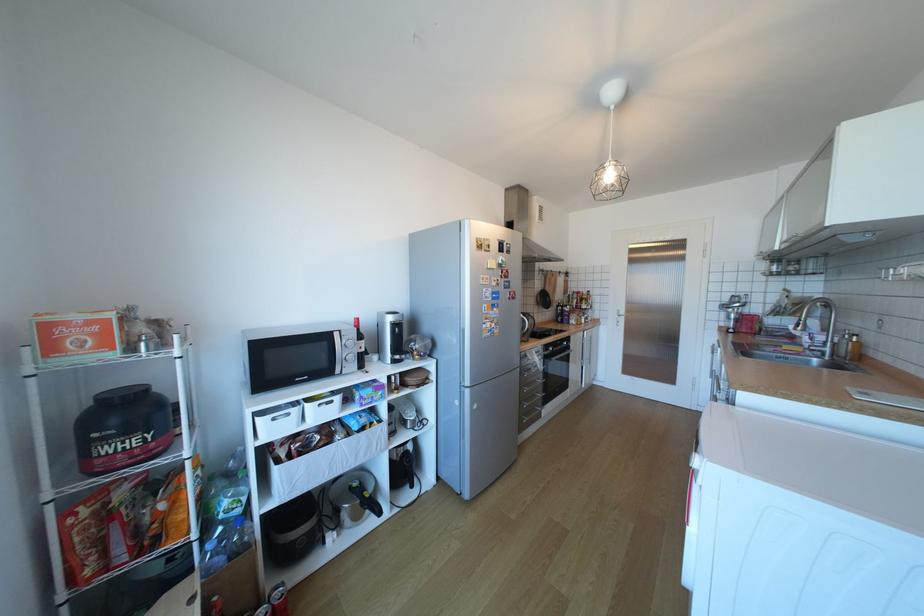
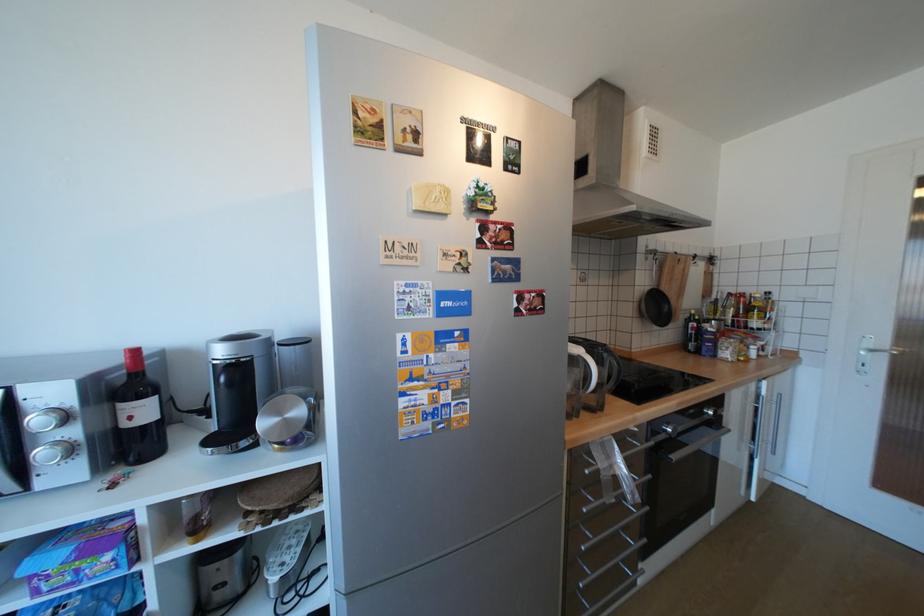
Locate, in the second image, the point that corresponds to [427,357] in the first image.

(286, 446)